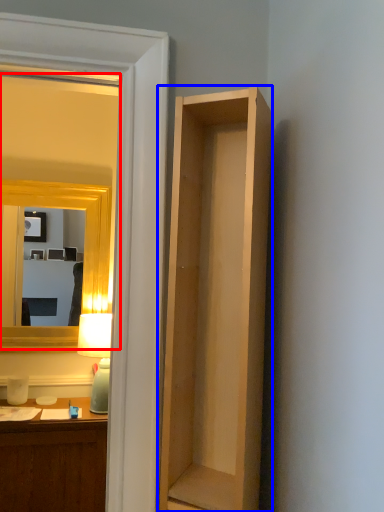
Question: Among these objects, which one is nearest to the camera, mirror (highlighted by a red box) or cabinetry (highlighted by a blue box)?

Choices:
 (A) mirror
 (B) cabinetry

Answer: (B)